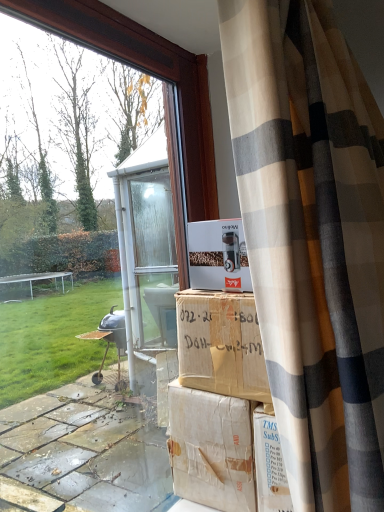
Find the location of `transparent glass window at center`. transparent glass window at center is located at coordinates (145, 70).

From the picture: In order to face brown cardboard box at center, the second cardboard box in the top-to-bottom sequence, should I rotate leftwards or rightwards?

Turn right approximately 4.365 degrees to face it.

Image resolution: width=384 pixels, height=512 pixels. Identify the location of white cardboard box at center, arranged as the 1th cardboard box when viewed from the top. (218, 256).

In the scene shown: From the image's perspective, who appears lower, transparent glass window at center or brown cardboard box at center, the second cardboard box in the top-to-bottom sequence?

brown cardboard box at center, the second cardboard box in the top-to-bottom sequence, is shown below in the image.

Are transparent glass window at center and brown cardboard box at center, the second cardboard box in the top-to-bottom sequence, beside each other?

No, transparent glass window at center is not in contact with brown cardboard box at center, the second cardboard box in the top-to-bottom sequence.

Could you measure the distance between transparent glass window at center and brown cardboard box at center, the 1th cardboard box in the bottom-to-top sequence?

They are 13.72 inches apart.

Which is correct: transparent glass window at center is inside brown cardboard box at center, the 1th cardboard box in the bottom-to-top sequence, or outside of it?

transparent glass window at center exists outside the volume of brown cardboard box at center, the 1th cardboard box in the bottom-to-top sequence.

Is the surface of transparent glass window at center in direct contact with white cardboard box at center, arranged as the 1th cardboard box when viewed from the top?

transparent glass window at center and white cardboard box at center, arranged as the 1th cardboard box when viewed from the top, are clearly separated.

Considering the points (175, 223) and (206, 272), which point is in front, point (175, 223) or point (206, 272)?

Point (206, 272)

Which object is positioned more to the left, transparent glass window at center or white cardboard box at center, arranged as the 1th cardboard box when viewed from the top?

From the viewer's perspective, transparent glass window at center appears more on the left side.

Is transparent glass window at center oriented towards white cardboard box at center, which is the 2th cardboard box from bottom to top?

Yes, transparent glass window at center is turned towards white cardboard box at center, which is the 2th cardboard box from bottom to top.

Is white cardboard box at center, which is the 2th cardboard box from bottom to top, to the left or to the right of brown cardboard box at center, the 1th cardboard box in the bottom-to-top sequence, in the image?

white cardboard box at center, which is the 2th cardboard box from bottom to top, is positioned on brown cardboard box at center, the 1th cardboard box in the bottom-to-top sequence,'s right side.

Between white cardboard box at center, arranged as the 1th cardboard box when viewed from the top, and brown cardboard box at center, the second cardboard box in the top-to-bottom sequence, which one has smaller width?

With smaller width is white cardboard box at center, arranged as the 1th cardboard box when viewed from the top.

From the image's perspective, which is below, white cardboard box at center, which is the 2th cardboard box from bottom to top, or brown cardboard box at center, the 1th cardboard box in the bottom-to-top sequence?

From the image's view, brown cardboard box at center, the 1th cardboard box in the bottom-to-top sequence, is below.

How different are the orientations of white cardboard box at center, which is the 2th cardboard box from bottom to top, and brown cardboard box at center, the 1th cardboard box in the bottom-to-top sequence, in degrees?

There is a 0.000779-degree angle between the facing directions of white cardboard box at center, which is the 2th cardboard box from bottom to top, and brown cardboard box at center, the 1th cardboard box in the bottom-to-top sequence.

Can you confirm if white cardboard box at center, which is the 2th cardboard box from bottom to top, is thinner than transparent glass window at center?

Indeed, white cardboard box at center, which is the 2th cardboard box from bottom to top, has a lesser width compared to transparent glass window at center.

Is white cardboard box at center, arranged as the 1th cardboard box when viewed from the top, looking in the opposite direction of transparent glass window at center?

No, white cardboard box at center, arranged as the 1th cardboard box when viewed from the top, is not facing the opposite direction of transparent glass window at center.

Between point (212, 271) and point (213, 166), which one is positioned in front?

The point (212, 271) is closer.

Considering the relative positions of white cardboard box at center, arranged as the 1th cardboard box when viewed from the top, and transparent glass window at center in the image provided, is white cardboard box at center, arranged as the 1th cardboard box when viewed from the top, to the right of transparent glass window at center from the viewer's perspective?

Yes, white cardboard box at center, arranged as the 1th cardboard box when viewed from the top, is to the right of transparent glass window at center.

Consider the image. Is white cardboard box at center, arranged as the 1th cardboard box when viewed from the top, located within brown cardboard box at center, the second cardboard box in the top-to-bottom sequence?

No.

Is brown cardboard box at center, the second cardboard box in the top-to-bottom sequence, oriented away from white cardboard box at center, which is the 2th cardboard box from bottom to top?

No, brown cardboard box at center, the second cardboard box in the top-to-bottom sequence, is not facing away from white cardboard box at center, which is the 2th cardboard box from bottom to top.

From the image's perspective, who appears lower, brown cardboard box at center, the second cardboard box in the top-to-bottom sequence, or white cardboard box at center, which is the 2th cardboard box from bottom to top?

brown cardboard box at center, the second cardboard box in the top-to-bottom sequence.

Looking at this image, how many degrees apart are the facing directions of brown cardboard box at center, the second cardboard box in the top-to-bottom sequence, and white cardboard box at center, arranged as the 1th cardboard box when viewed from the top?

The facing directions of brown cardboard box at center, the second cardboard box in the top-to-bottom sequence, and white cardboard box at center, arranged as the 1th cardboard box when viewed from the top, are 0.000779 degrees apart.

Is brown cardboard box at center, the second cardboard box in the top-to-bottom sequence, turned away from transparent glass window at center?

That's not correct — brown cardboard box at center, the second cardboard box in the top-to-bottom sequence, is not looking away from transparent glass window at center.

Would you say brown cardboard box at center, the 1th cardboard box in the bottom-to-top sequence, contains transparent glass window at center?

No, transparent glass window at center is not a part of brown cardboard box at center, the 1th cardboard box in the bottom-to-top sequence.

Considering the relative positions of brown cardboard box at center, the second cardboard box in the top-to-bottom sequence, and transparent glass window at center in the image provided, is brown cardboard box at center, the second cardboard box in the top-to-bottom sequence, to the right of transparent glass window at center from the viewer's perspective?

Indeed, brown cardboard box at center, the second cardboard box in the top-to-bottom sequence, is positioned on the right side of transparent glass window at center.

Is brown cardboard box at center, the 1th cardboard box in the bottom-to-top sequence, not near transparent glass window at center?

brown cardboard box at center, the 1th cardboard box in the bottom-to-top sequence, is near transparent glass window at center, not far away.

The width and height of the screenshot is (384, 512). I want to click on cardboard box below the transparent glass window at center (from the image's perspective), so click(221, 344).

Where is `window that appears on the left of white cardboard box at center, arranged as the 1th cardboard box when viewed from the top`? The width and height of the screenshot is (384, 512). window that appears on the left of white cardboard box at center, arranged as the 1th cardboard box when viewed from the top is located at coordinates (145, 70).

Based on the photo, from the image, which object appears to be nearer to white cardboard box at center, which is the 2th cardboard box from bottom to top, transparent glass window at center or brown cardboard box at center, the second cardboard box in the top-to-bottom sequence?

brown cardboard box at center, the second cardboard box in the top-to-bottom sequence, is positioned closer to the anchor white cardboard box at center, which is the 2th cardboard box from bottom to top.

Estimate the real-world distances between objects in this image. Which object is closer to transparent glass window at center, white cardboard box at center, arranged as the 1th cardboard box when viewed from the top, or brown cardboard box at center, the 1th cardboard box in the bottom-to-top sequence?

white cardboard box at center, arranged as the 1th cardboard box when viewed from the top, is closer to transparent glass window at center.

From the image, which object appears to be nearer to brown cardboard box at center, the second cardboard box in the top-to-bottom sequence, transparent glass window at center or white cardboard box at center, which is the 2th cardboard box from bottom to top?

Based on the image, white cardboard box at center, which is the 2th cardboard box from bottom to top, appears to be nearer to brown cardboard box at center, the second cardboard box in the top-to-bottom sequence.

Consider the image. Considering their positions, is white cardboard box at center, which is the 2th cardboard box from bottom to top, positioned closer to brown cardboard box at center, the 1th cardboard box in the bottom-to-top sequence, than transparent glass window at center?

Based on the image, white cardboard box at center, which is the 2th cardboard box from bottom to top, appears to be nearer to brown cardboard box at center, the 1th cardboard box in the bottom-to-top sequence.

From the image, which object appears to be nearer to white cardboard box at center, which is the 2th cardboard box from bottom to top, brown cardboard box at center, the 1th cardboard box in the bottom-to-top sequence, or transparent glass window at center?

brown cardboard box at center, the 1th cardboard box in the bottom-to-top sequence, lies closer to white cardboard box at center, which is the 2th cardboard box from bottom to top, than the other object.

Based on their spatial positions, is brown cardboard box at center, the second cardboard box in the top-to-bottom sequence, or white cardboard box at center, arranged as the 1th cardboard box when viewed from the top, closer to transparent glass window at center?

white cardboard box at center, arranged as the 1th cardboard box when viewed from the top.

You are a GUI agent. You are given a task and a screenshot of the screen. Output one action in this format:
    pyautogui.click(x=<x>, y=<y>)
    Task: Click on the cardboard box positioned between transparent glass window at center and white cardboard box at center, which is the 2th cardboard box from bottom to top, from near to far
    This screenshot has height=512, width=384.
    Given the screenshot: What is the action you would take?
    pyautogui.click(x=221, y=344)